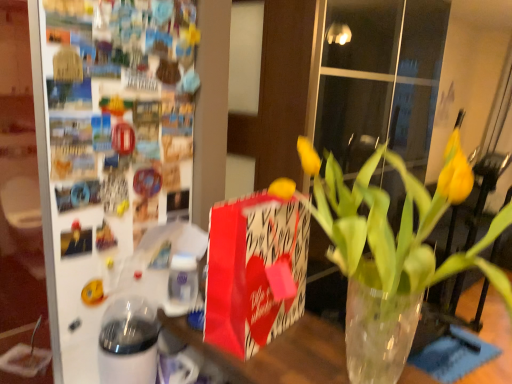
Question: Is the position of yellow matte vase at center more distant than that of translucent glass vase at center?

Choices:
 (A) yes
 (B) no

Answer: (B)

Question: From the image's perspective, would you say yellow matte vase at center is positioned over translucent glass vase at center?

Choices:
 (A) no
 (B) yes

Answer: (B)

Question: Can we say yellow matte vase at center lies outside translucent glass vase at center?

Choices:
 (A) no
 (B) yes

Answer: (B)

Question: Does yellow matte vase at center appear on the right side of translucent glass vase at center?

Choices:
 (A) yes
 (B) no

Answer: (A)

Question: Is yellow matte vase at center shorter than translucent glass vase at center?

Choices:
 (A) yes
 (B) no

Answer: (B)

Question: Is there a large distance between yellow matte vase at center and translucent glass vase at center?

Choices:
 (A) no
 (B) yes

Answer: (B)

Question: Does white glossy glass jar at lower left appear on the left side of yellow matte vase at center?

Choices:
 (A) no
 (B) yes

Answer: (B)

Question: Considering the relative sizes of white glossy glass jar at lower left and yellow matte vase at center in the image provided, is white glossy glass jar at lower left taller than yellow matte vase at center?

Choices:
 (A) yes
 (B) no

Answer: (B)

Question: Are white glossy glass jar at lower left and yellow matte vase at center beside each other?

Choices:
 (A) yes
 (B) no

Answer: (B)

Question: From a real-world perspective, is white glossy glass jar at lower left located beneath yellow matte vase at center?

Choices:
 (A) yes
 (B) no

Answer: (A)

Question: Is yellow matte vase at center located within white glossy glass jar at lower left?

Choices:
 (A) yes
 (B) no

Answer: (B)

Question: Is white glossy glass jar at lower left not near yellow matte vase at center?

Choices:
 (A) yes
 (B) no

Answer: (B)

Question: Is red paper gift bag at center to the left of translucent glass vase at center from the viewer's perspective?

Choices:
 (A) yes
 (B) no

Answer: (B)